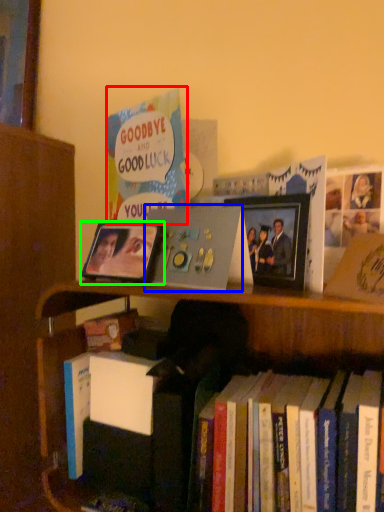
Question: Which object is positioned farthest from book (highlighted by a red box)? Select from paperback book (highlighted by a blue box) and picture frame (highlighted by a green box).

Choices:
 (A) paperback book
 (B) picture frame

Answer: (A)